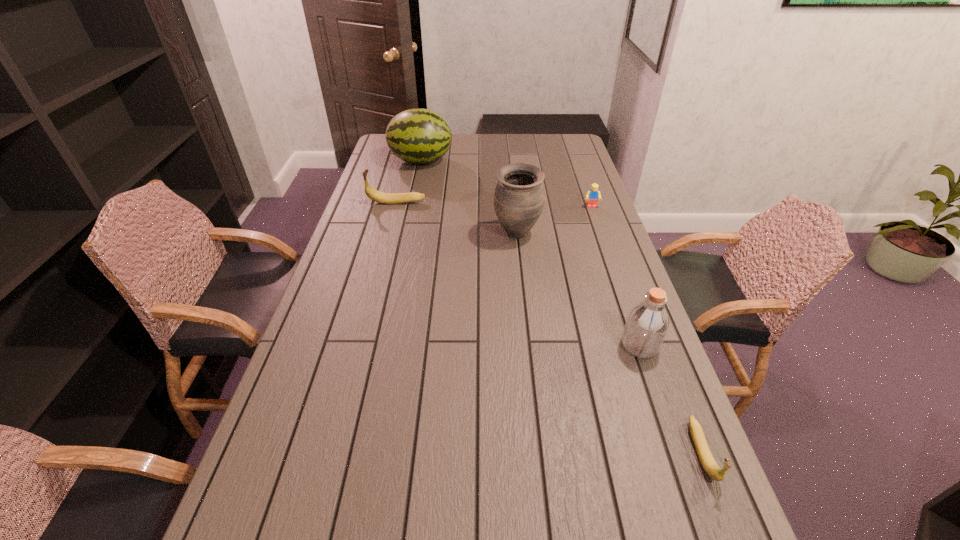
The width and height of the screenshot is (960, 540). I want to click on vacant space situated at the stem end of the watermelon, so click(x=467, y=161).

Where is `vacant space situated 0.180m on the left of the fourth object from right to left`? The width and height of the screenshot is (960, 540). vacant space situated 0.180m on the left of the fourth object from right to left is located at coordinates (441, 234).

The width and height of the screenshot is (960, 540). I want to click on vacant space located 0.200m on the front of the bottle, so click(671, 433).

The width and height of the screenshot is (960, 540). In order to click on vacant space located on the front-facing side of the Lego in this screenshot , I will do `click(602, 237)`.

The width and height of the screenshot is (960, 540). What are the coordinates of `object present at the far edge` in the screenshot? It's located at (420, 136).

Find the location of a particular element. The height and width of the screenshot is (540, 960). object present at the near edge is located at coordinates (710, 466).

Find the location of a particular element. Image resolution: width=960 pixels, height=540 pixels. banana at the left edge is located at coordinates (388, 198).

Locate an element on the screen. watermelon that is at the left edge is located at coordinates (420, 136).

Image resolution: width=960 pixels, height=540 pixels. In order to click on banana positioned at the right edge in this screenshot , I will do `click(710, 466)`.

The width and height of the screenshot is (960, 540). In order to click on bottle located in the right edge section of the desktop in this screenshot , I will do (x=647, y=323).